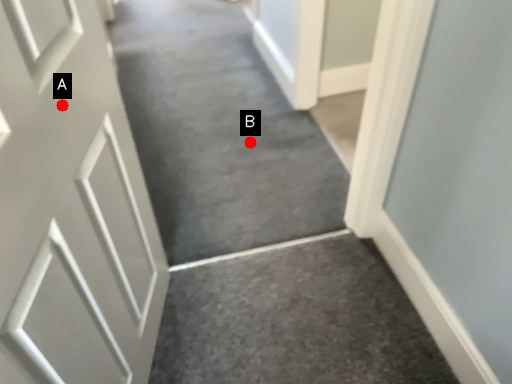
Question: Two points are circled on the image, labeled by A and B beside each circle. Which point is closer to the camera?

Choices:
 (A) A is closer
 (B) B is closer

Answer: (A)